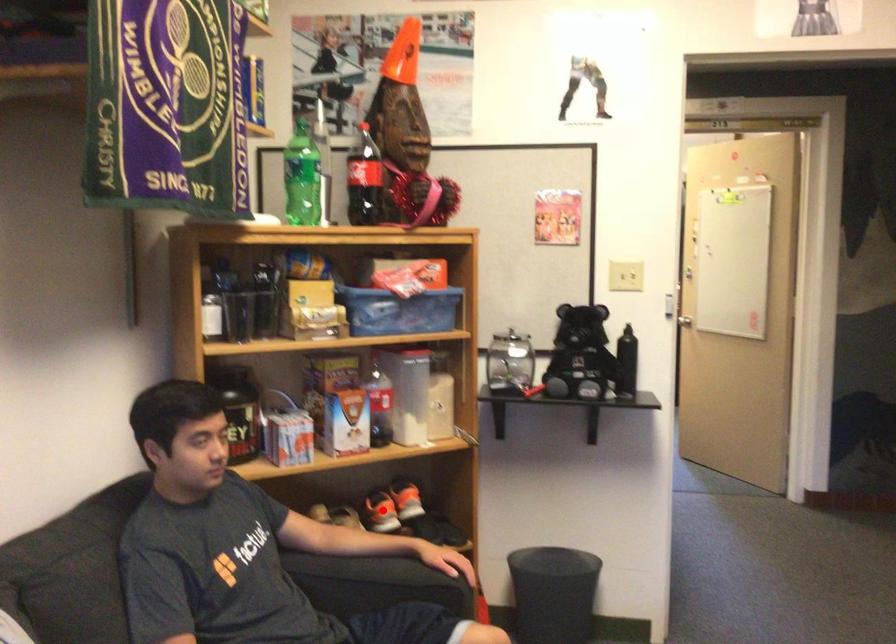
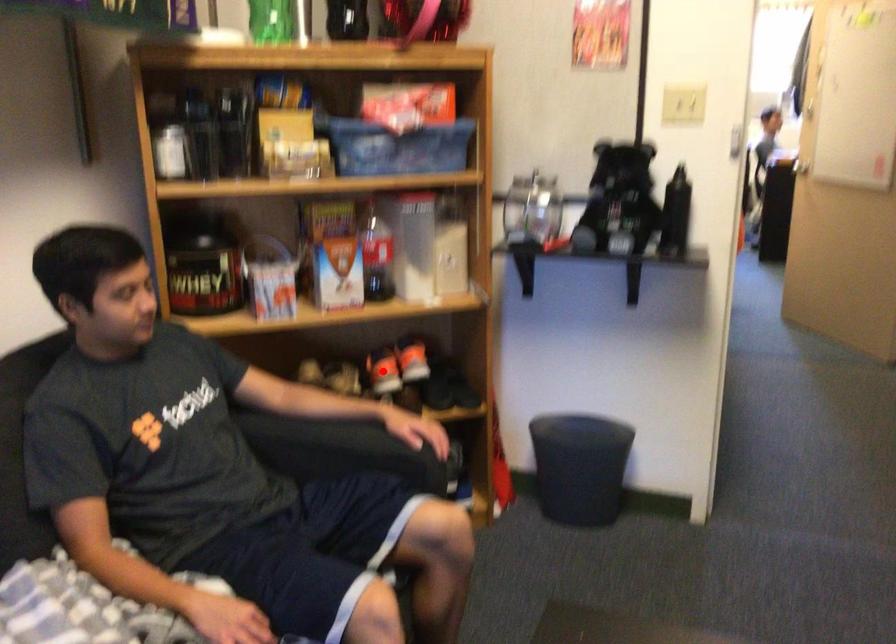
I am providing you with two images of the same scene from different viewpoints. A red point is marked on the first image and another point is marked on the second image. Is the marked point in image1 the same physical position as the marked point in image2?

Yes